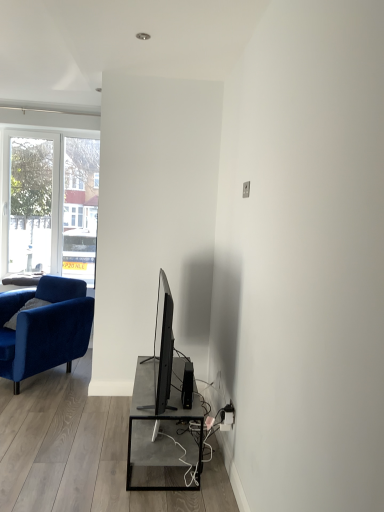
Question: Is black plastic speaker at lower center situated inside velvet blue armchair at left or outside?

Choices:
 (A) outside
 (B) inside

Answer: (A)

Question: Is black plastic speaker at lower center in front of or behind velvet blue armchair at left in the image?

Choices:
 (A) behind
 (B) front

Answer: (B)

Question: From a real-world perspective, is black plastic speaker at lower center physically located above or below velvet blue armchair at left?

Choices:
 (A) above
 (B) below

Answer: (A)

Question: In terms of width, does velvet blue armchair at left look wider or thinner when compared to black plastic speaker at lower center?

Choices:
 (A) wide
 (B) thin

Answer: (A)

Question: Is velvet blue armchair at left bigger or smaller than black plastic speaker at lower center?

Choices:
 (A) small
 (B) big

Answer: (B)

Question: In terms of height, does velvet blue armchair at left look taller or shorter compared to black plastic speaker at lower center?

Choices:
 (A) short
 (B) tall

Answer: (B)

Question: Relative to black plastic speaker at lower center, is velvet blue armchair at left in front or behind?

Choices:
 (A) front
 (B) behind

Answer: (B)